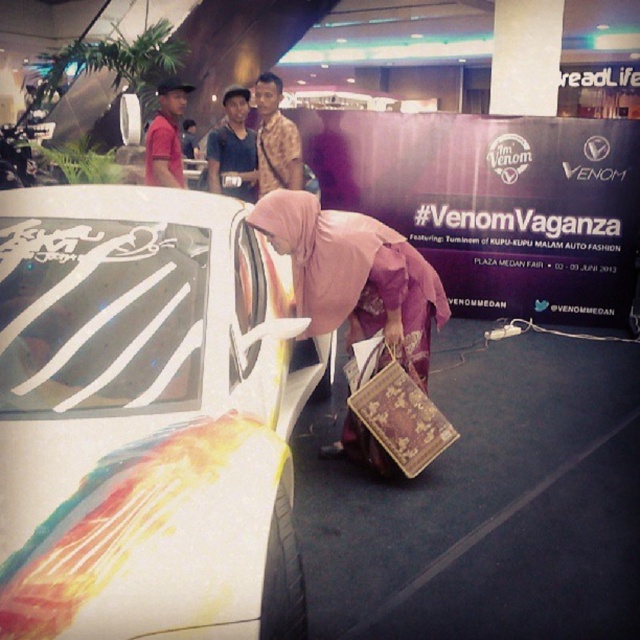
Is shiny metallic car at center taller than matte red shirt at left?

Yes.

Who is positioned more to the right, shiny metallic car at center or matte red shirt at left?

Positioned to the right is shiny metallic car at center.

Does point (113, 593) come in front of point (172, 102)?

Yes.

This screenshot has height=640, width=640. I want to click on shiny metallic car at center, so click(x=144, y=419).

Who is higher up, shiny metallic car at center or matte blue shirt at upper center?

matte blue shirt at upper center is higher up.

Is point (227, 387) in front of point (211, 177)?

Yes, point (227, 387) is in front of point (211, 177).

The image size is (640, 640). I want to click on shiny metallic car at center, so click(x=144, y=419).

Between shiny metallic car at center and pink fabric hijab at center, which one appears on the right side from the viewer's perspective?

pink fabric hijab at center

Between point (19, 506) and point (291, 225), which one is positioned behind?

Point (291, 225)

Who is more forward, (188, 372) or (346, 300)?

Point (188, 372)

What are the coordinates of `shiny metallic car at center` in the screenshot? It's located at pos(144,419).